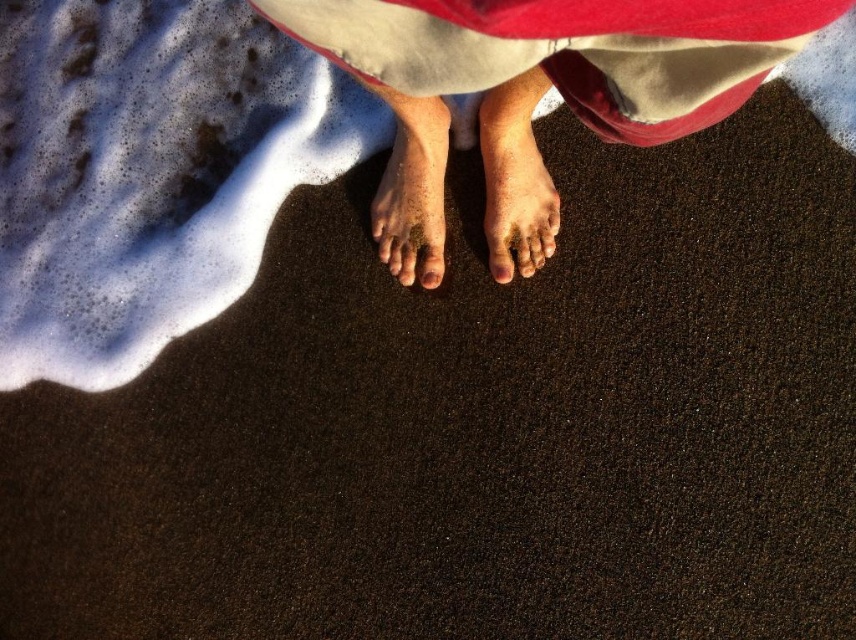
Find the location of a particular element. This screenshot has height=640, width=856. smooth skin feet at center is located at coordinates (533, 97).

Is point (403, 88) positioned before point (522, 81)?

Yes, it is.

Locate an element on the screen. This screenshot has height=640, width=856. smooth skin feet at center is located at coordinates tap(533, 97).

Is point (428, 81) less distant than point (417, 99)?

Yes, it is in front of point (417, 99).

Who is more distant from viewer, (394,61) or (403,168)?

The point (403,168) is behind.

The image size is (856, 640). I want to click on smooth skin feet at center, so click(533, 97).

Does dry sand foot at center come behind brown sand at center?

Yes, dry sand foot at center is further from the viewer.

Which of these two, dry sand foot at center or brown sand at center, stands shorter?

With less height is brown sand at center.

Does point (502, 170) lie behind point (384, 216)?

No, it is not.

I want to click on dry sand foot at center, so click(515, 179).